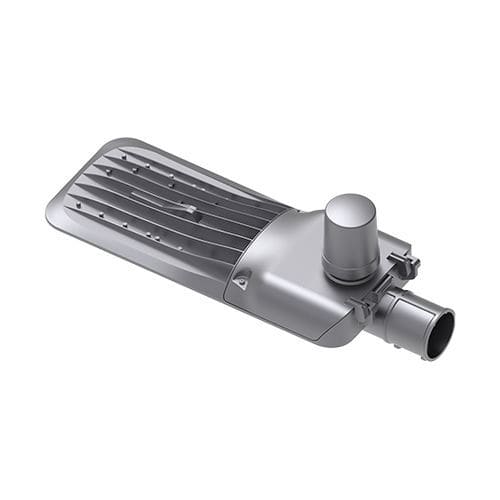
In order to click on space above mirror in this screenshot , I will do `click(227, 127)`.